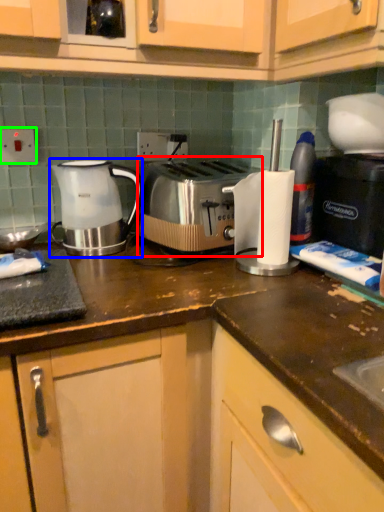
Question: Which is nearer to the toaster (highlighted by a red box)? kettle (highlighted by a blue box) or electric outlet (highlighted by a green box).

Choices:
 (A) kettle
 (B) electric outlet

Answer: (A)